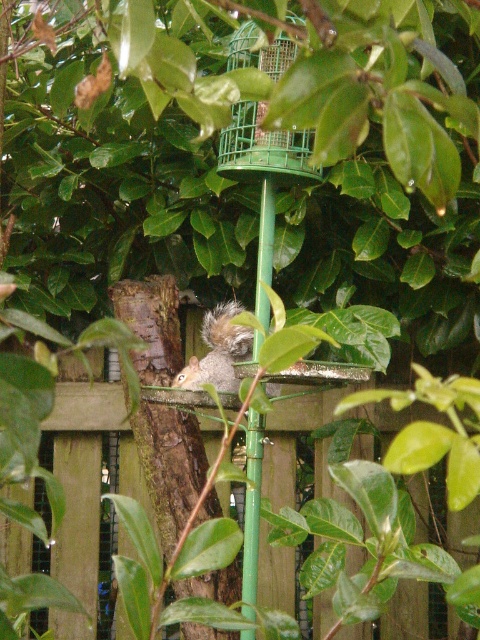
You are a bird trying to reach the green wire mesh bird feeder at center. There is a gray furry squirrel at center nearby. Which obstacle is taller, the bird feeder or the squirrel?

The green wire mesh bird feeder at center is taller than the gray furry squirrel at center, so the bird feeder is the taller obstacle.

You are a bird trying to reach the green wire mesh bird feeder at center. There is a wooden fence at center blocking your path. Which object takes up more space in your view?

The green wire mesh bird feeder at center takes up more space in your view than the wooden fence at center because the wooden fence at center occupies less space than green wire mesh bird feeder at center.

You are standing at the point labeled as point (169, 465) in the garden scene. What object are you directly facing?

The point (169, 465) corresponds to the brown rough tree trunk at center, so you are directly facing the brown rough tree trunk at center.